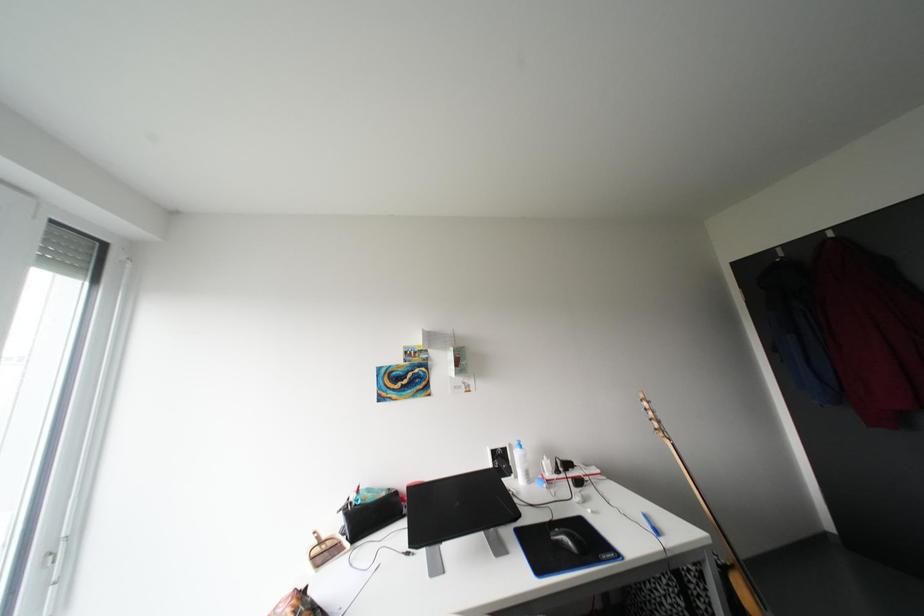
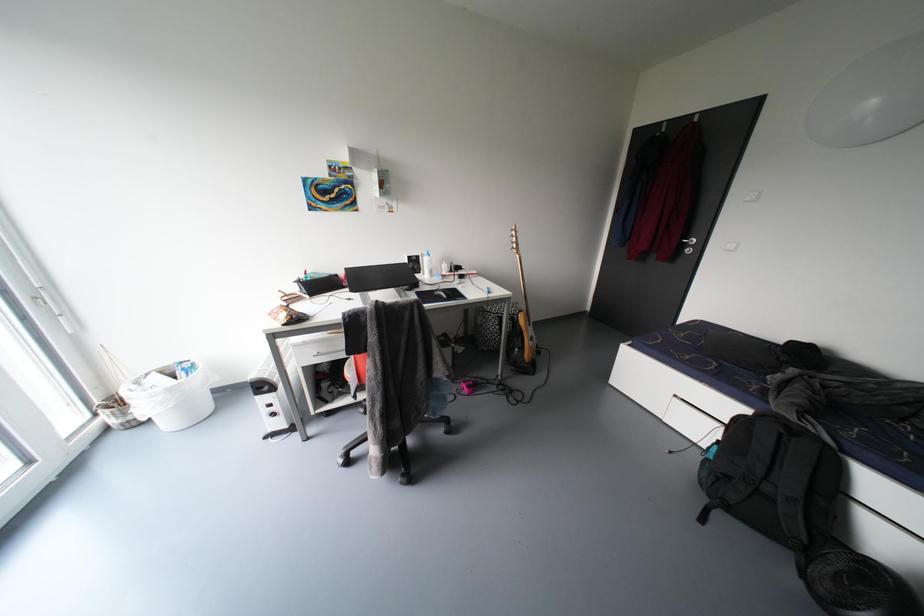
How did the camera likely rotate?

The camera rotated toward right-down.